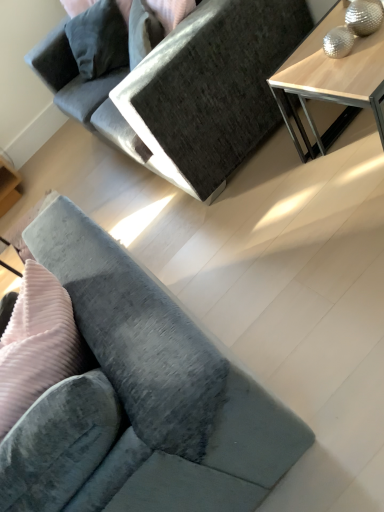
Question: Is velvet gray couch at center, the 2th studio couch from the bottom, oriented away from velvet grey couch at lower left, which is the first studio couch in bottom-to-top order?

Choices:
 (A) yes
 (B) no

Answer: (B)

Question: Is velvet gray couch at center, the 2th studio couch from the bottom, in contact with velvet grey couch at lower left, marked as the 2th studio couch in a top-to-bottom arrangement?

Choices:
 (A) yes
 (B) no

Answer: (B)

Question: Is velvet gray couch at center, the 2th studio couch from the bottom, at the right side of velvet grey couch at lower left, which is the first studio couch in bottom-to-top order?

Choices:
 (A) yes
 (B) no

Answer: (A)

Question: Is velvet gray couch at center, the 2th studio couch from the bottom, at the left side of velvet grey couch at lower left, marked as the 2th studio couch in a top-to-bottom arrangement?

Choices:
 (A) no
 (B) yes

Answer: (A)

Question: Considering the relative sizes of velvet gray couch at center, the 2th studio couch from the bottom, and velvet grey couch at lower left, which is the first studio couch in bottom-to-top order, in the image provided, is velvet gray couch at center, the 2th studio couch from the bottom, wider than velvet grey couch at lower left, which is the first studio couch in bottom-to-top order,?

Choices:
 (A) no
 (B) yes

Answer: (A)

Question: From the image's perspective, relative to velvet gray couch at center, the 1th studio couch positioned from the top, is light wood table at upper right above or below?

Choices:
 (A) below
 (B) above

Answer: (A)

Question: In the image, is light wood table at upper right positioned in front of or behind velvet gray couch at center, the 1th studio couch positioned from the top?

Choices:
 (A) front
 (B) behind

Answer: (A)

Question: Is light wood table at upper right situated inside velvet gray couch at center, the 1th studio couch positioned from the top, or outside?

Choices:
 (A) outside
 (B) inside

Answer: (A)

Question: Is light wood table at upper right taller or shorter than velvet gray couch at center, the 2th studio couch from the bottom?

Choices:
 (A) short
 (B) tall

Answer: (A)

Question: In terms of height, does velvet gray couch at center, the 1th studio couch positioned from the top, look taller or shorter compared to velvet grey couch at lower left, which is the first studio couch in bottom-to-top order?

Choices:
 (A) tall
 (B) short

Answer: (A)

Question: Does point (122, 126) appear closer or farther from the camera than point (183, 500)?

Choices:
 (A) closer
 (B) farther

Answer: (B)

Question: Would you say velvet gray couch at center, the 2th studio couch from the bottom, is to the left or to the right of velvet grey couch at lower left, marked as the 2th studio couch in a top-to-bottom arrangement, in the picture?

Choices:
 (A) right
 (B) left

Answer: (A)

Question: Would you say velvet gray couch at center, the 2th studio couch from the bottom, is inside or outside velvet grey couch at lower left, which is the first studio couch in bottom-to-top order?

Choices:
 (A) inside
 (B) outside

Answer: (B)

Question: Is light wood table at upper right bigger or smaller than velvet grey couch at lower left, marked as the 2th studio couch in a top-to-bottom arrangement?

Choices:
 (A) small
 (B) big

Answer: (A)

Question: Choose the correct answer: Is light wood table at upper right inside velvet grey couch at lower left, which is the first studio couch in bottom-to-top order, or outside it?

Choices:
 (A) outside
 (B) inside

Answer: (A)